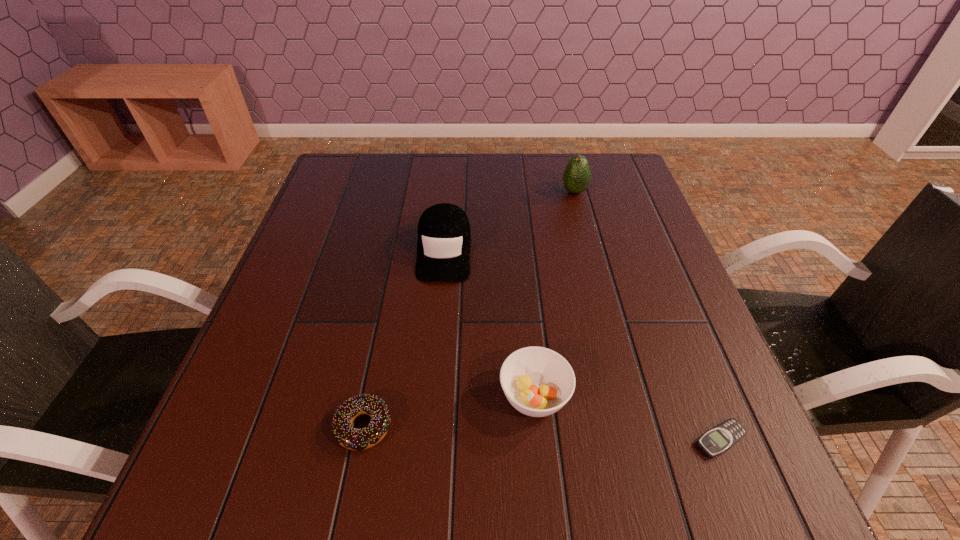
Locate an element on the screen. This screenshot has height=540, width=960. vacant region located on the front-facing side of the fourth shortest object is located at coordinates (437, 329).

Find the location of a particular element. vacant space situated 0.350m on the left of the third tallest object is located at coordinates (306, 396).

You are a GUI agent. You are given a task and a screenshot of the screen. Output one action in this format:
    pyautogui.click(x=<x>, y=<y>)
    Task: Click on the vacant space located on the back of the doughnut
    This screenshot has height=540, width=960.
    Given the screenshot: What is the action you would take?
    pyautogui.click(x=389, y=301)

At what (x,y) coordinates should I click in order to perform the action: click on free space located on the back of the rightmost object. Please return your answer as a coordinate pair (x, y). Looking at the image, I should click on (679, 334).

Where is `object located at the far edge`? The width and height of the screenshot is (960, 540). object located at the far edge is located at coordinates (577, 175).

The height and width of the screenshot is (540, 960). I want to click on object positioned at the near edge, so click(720, 438).

Identify the location of avocado present at the right edge. (577, 175).

I want to click on beeper at the right edge, so click(x=720, y=438).

At what (x,y) coordinates should I click in order to perform the action: click on object that is at the far right corner. Please return your answer as a coordinate pair (x, y). Image resolution: width=960 pixels, height=540 pixels. Looking at the image, I should click on (577, 175).

Find the location of a particular element. This screenshot has width=960, height=540. object situated at the near right corner is located at coordinates (720, 438).